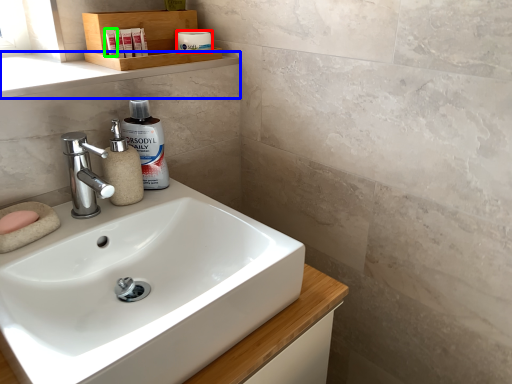
Question: Estimate the real-world distances between objects in this image. Which object is farther from toiletry (highlighted by a red box), window sill (highlighted by a blue box) or toiletry (highlighted by a green box)?

Choices:
 (A) window sill
 (B) toiletry

Answer: (A)